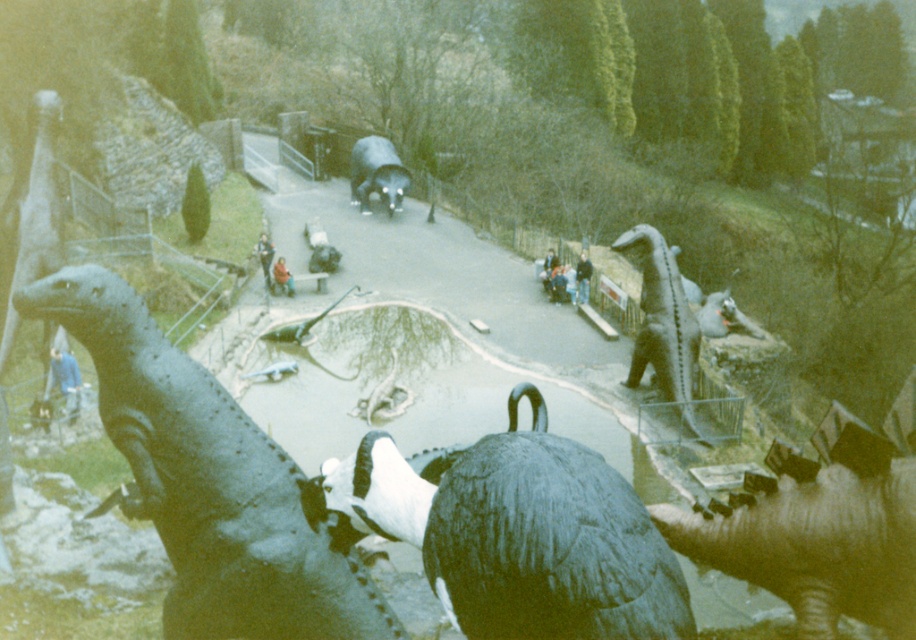
You are a visitor in this miniature park and want to take a photo of the shiny metallic dinosaur at center without including the blue fabric person at lower left in the frame. Based on their positions, is this possible?

The shiny metallic dinosaur at center is positioned on the right side of the blue fabric person at lower left, so if you move to the left side of the blue fabric person at lower left, you can frame the photo to exclude them while capturing the shiny metallic dinosaur at center.

You are a visitor standing in the park and you see the shiny metallic dinosaur at center and the dark blue jeans at center. Which object is closer to the ground?

The shiny metallic dinosaur at center is closer to the ground because it is located below dark blue jeans at center.

You are a visitor in the park and want to take a photo of both the black matte turtle at center and the blue jeans at center. Which object should you focus on first if you want to include both in the same frame without zooming in or out?

The black matte turtle at center is bigger than blue jeans at center, so you should focus on the black matte turtle at center first to ensure both fit in the frame.